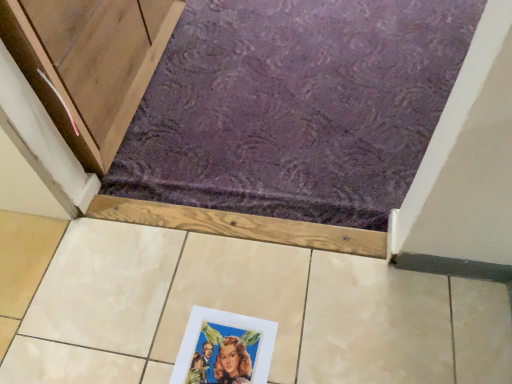
Question: Is matte paper picture frame at lower center at the left side of purple textured carpet at upper center?

Choices:
 (A) yes
 (B) no

Answer: (A)

Question: From the image's perspective, would you say matte paper picture frame at lower center is shown under purple textured carpet at upper center?

Choices:
 (A) no
 (B) yes

Answer: (B)

Question: From a real-world perspective, is matte paper picture frame at lower center positioned under purple textured carpet at upper center based on gravity?

Choices:
 (A) yes
 (B) no

Answer: (B)

Question: Is purple textured carpet at upper center at the back of matte paper picture frame at lower center?

Choices:
 (A) no
 (B) yes

Answer: (A)

Question: Does matte paper picture frame at lower center have a greater height compared to purple textured carpet at upper center?

Choices:
 (A) no
 (B) yes

Answer: (A)

Question: Considering the relative sizes of matte paper picture frame at lower center and purple textured carpet at upper center in the image provided, is matte paper picture frame at lower center wider than purple textured carpet at upper center?

Choices:
 (A) yes
 (B) no

Answer: (B)

Question: Is purple textured carpet at upper center far from matte paper picture frame at lower center?

Choices:
 (A) yes
 (B) no

Answer: (B)

Question: Can you confirm if purple textured carpet at upper center is taller than matte paper picture frame at lower center?

Choices:
 (A) no
 (B) yes

Answer: (B)

Question: Is matte paper picture frame at lower center inside purple textured carpet at upper center?

Choices:
 (A) no
 (B) yes

Answer: (A)

Question: Is purple textured carpet at upper center facing away from matte paper picture frame at lower center?

Choices:
 (A) yes
 (B) no

Answer: (B)

Question: Is the depth of purple textured carpet at upper center less than that of matte paper picture frame at lower center?

Choices:
 (A) no
 (B) yes

Answer: (A)

Question: From a real-world perspective, is purple textured carpet at upper center on matte paper picture frame at lower center?

Choices:
 (A) no
 (B) yes

Answer: (A)

Question: Is point (192, 365) positioned closer to the camera than point (181, 172)?

Choices:
 (A) closer
 (B) farther

Answer: (A)